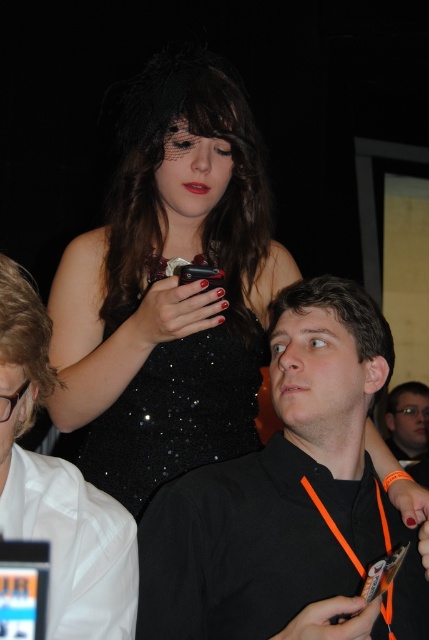
Question: Can you confirm if black sequined dress at upper center is positioned below black matte shirt at center?

Choices:
 (A) no
 (B) yes

Answer: (A)

Question: Is black sequined dress at upper center thinner than black sequined dress at center?

Choices:
 (A) yes
 (B) no

Answer: (B)

Question: Which point is closer to the camera?

Choices:
 (A) black matte shirt at center
 (B) black sequined dress at center
 (C) white glossy shirt at upper left
 (D) black sequined dress at upper center

Answer: (C)

Question: Estimate the real-world distances between objects in this image. Which object is farther from the black matte shirt at center?

Choices:
 (A) black sequined dress at upper center
 (B) black sequined dress at center

Answer: (A)

Question: Which point appears closest to the camera in this image?

Choices:
 (A) (192, 372)
 (B) (369, 369)
 (C) (48, 342)
 (D) (174, 474)

Answer: (C)

Question: Does black sequined dress at upper center have a larger size compared to black matte shirt at center?

Choices:
 (A) no
 (B) yes

Answer: (B)